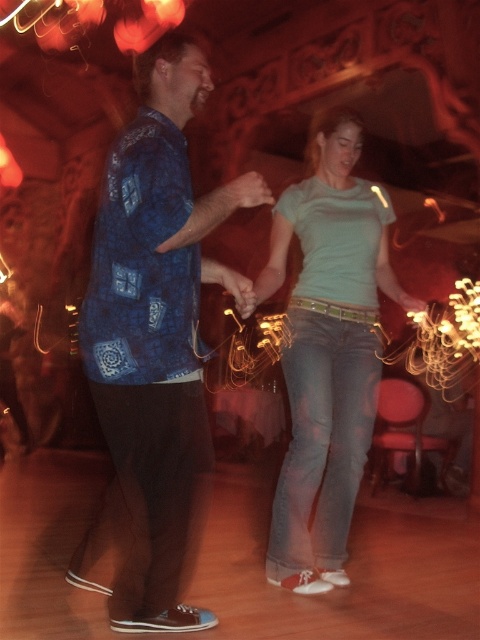
Is blue printed shirt at center smaller than light blue denim jeans at center?

No.

Between point (148, 508) and point (269, 534), which one is positioned in front?

Point (148, 508) is in front.

Where is `blue printed shirt at center`? Image resolution: width=480 pixels, height=640 pixels. blue printed shirt at center is located at coordinates (153, 348).